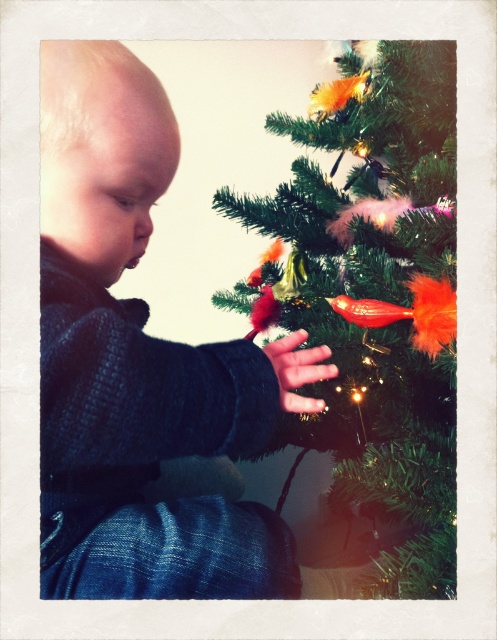
Question: Is dark blue knitted sweater at left to the right of green matte christmas tree at center from the viewer's perspective?

Choices:
 (A) yes
 (B) no

Answer: (B)

Question: Where is dark blue knitted sweater at left located in relation to green matte christmas tree at center in the image?

Choices:
 (A) above
 (B) below

Answer: (A)

Question: Which point is closer to the camera taking this photo?

Choices:
 (A) (393, 227)
 (B) (159, 173)

Answer: (B)

Question: Does dark blue knitted sweater at left have a lesser width compared to green matte christmas tree at center?

Choices:
 (A) no
 (B) yes

Answer: (B)